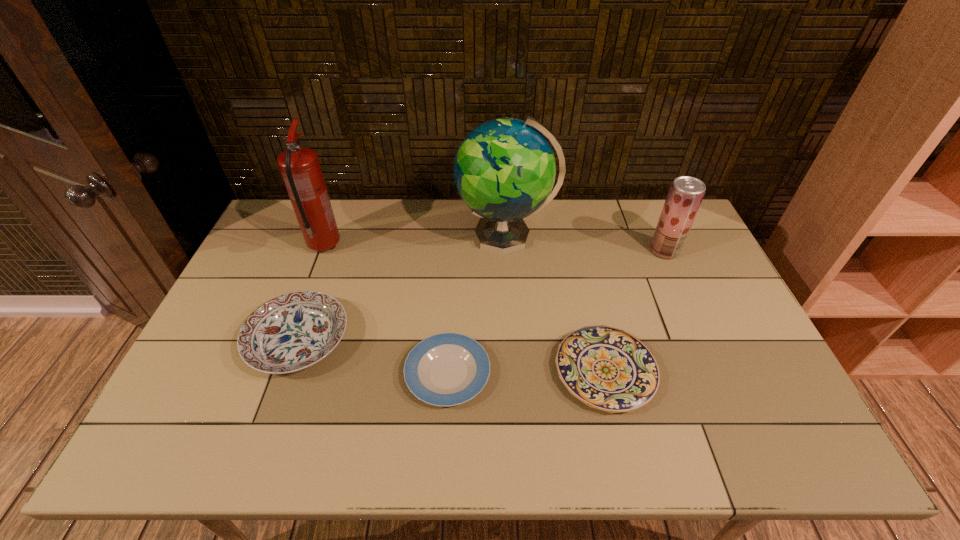
Locate an element on the screen. Image resolution: width=960 pixels, height=540 pixels. free space located 0.160m on the front surface of the globe is located at coordinates (411, 236).

Identify the location of free space located on the handle side the fire extinguisher. (340, 205).

In order to click on free space located 0.120m on the handle side the fire extinguisher in this screenshot , I will do `click(338, 210)`.

Image resolution: width=960 pixels, height=540 pixels. Identify the location of vacant space situated on the handle side the fire extinguisher. (340, 205).

Locate an element on the screen. The image size is (960, 540). free space located 0.260m on the left of the rightmost object is located at coordinates (571, 251).

Locate an element on the screen. The height and width of the screenshot is (540, 960). vacant region located on the left of the leftmost plate is located at coordinates (228, 340).

Where is `vacant space situated 0.170m on the back of the rightmost plate`? This screenshot has width=960, height=540. vacant space situated 0.170m on the back of the rightmost plate is located at coordinates (586, 287).

Where is `free space located on the left of the second plate from left to right`? Image resolution: width=960 pixels, height=540 pixels. free space located on the left of the second plate from left to right is located at coordinates click(x=311, y=373).

Where is `globe at the far edge`? globe at the far edge is located at coordinates [x=504, y=170].

Where is `fire extinguisher that is at the far edge`? The height and width of the screenshot is (540, 960). fire extinguisher that is at the far edge is located at coordinates (299, 166).